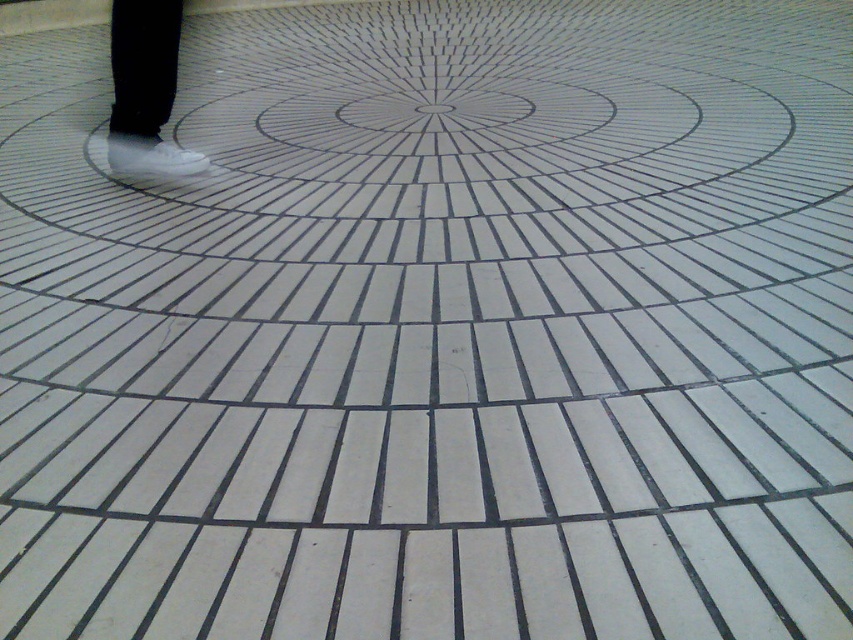
You are standing at the center of the tiled floor and want to place a decorative object exactly where the white matte shoe at center was positioned. What are the coordinates where you should place the object?

The coordinates for placing the decorative object should be at point (144,90), as this matches the 2D location of the white matte shoe at center.

You are standing on the tiled floor and want to place a small potted plant exactly at the center of the radial pattern. However, there is an obstacle at point (144, 90). Where should you place the potted plant instead?

The white matte shoe at center is located at point (144, 90), so you should place the potted plant at the central point of the radial design, which is at the top of the frame, avoiding the obstacle at the given coordinates.

You are standing at the central point of the tiled floor and want to walk towards the upper left corner. There are two points marked on the floor at coordinates point (122, 64) and point (132, 173). Which point will you encounter first on your path?

Point (122, 64) is in front of point (132, 173), so you will encounter point (122, 64) first on your path towards the upper left corner.